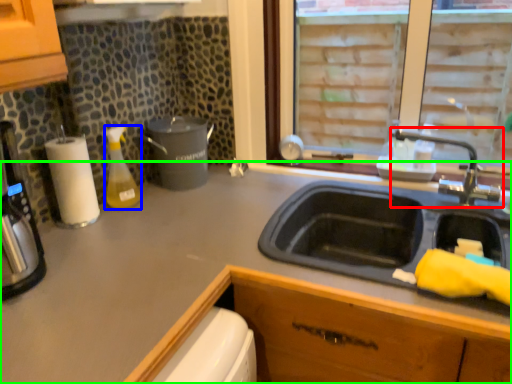
Question: Estimate the real-world distances between objects in this image. Which object is closer to tap (highlighted by a red box), bottle (highlighted by a blue box) or countertop (highlighted by a green box)?

Choices:
 (A) bottle
 (B) countertop

Answer: (B)